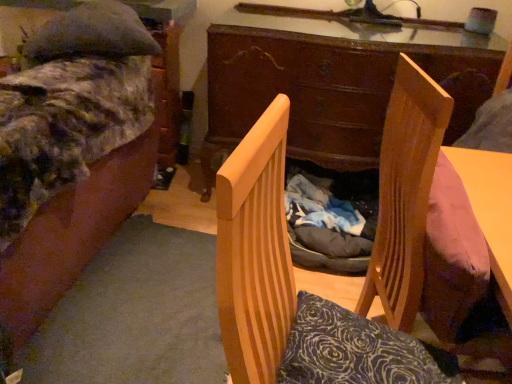
Question: From the image's perspective, is velvet-like fabric bed at left above wooden desk at center?

Choices:
 (A) no
 (B) yes

Answer: (A)

Question: Does velvet-like fabric bed at left have a smaller size compared to wooden desk at center?

Choices:
 (A) yes
 (B) no

Answer: (B)

Question: Considering the relative sizes of velvet-like fabric bed at left and wooden desk at center in the image provided, is velvet-like fabric bed at left shorter than wooden desk at center?

Choices:
 (A) yes
 (B) no

Answer: (B)

Question: Is velvet-like fabric bed at left wider than wooden desk at center?

Choices:
 (A) no
 (B) yes

Answer: (B)

Question: Is velvet-like fabric bed at left taller than wooden desk at center?

Choices:
 (A) no
 (B) yes

Answer: (B)

Question: Is velvet-like fabric bed at left thinner than wooden desk at center?

Choices:
 (A) no
 (B) yes

Answer: (A)

Question: Is the depth of wooden desk at center greater than that of velvet-like fabric bed at left?

Choices:
 (A) no
 (B) yes

Answer: (B)

Question: Can you confirm if wooden desk at center is smaller than velvet-like fabric bed at left?

Choices:
 (A) yes
 (B) no

Answer: (A)

Question: Is wooden desk at center at the left side of velvet-like fabric bed at left?

Choices:
 (A) no
 (B) yes

Answer: (A)

Question: From a real-world perspective, does wooden desk at center sit lower than velvet-like fabric bed at left?

Choices:
 (A) no
 (B) yes

Answer: (A)

Question: Does wooden desk at center have a lesser height compared to velvet-like fabric bed at left?

Choices:
 (A) yes
 (B) no

Answer: (A)

Question: Does wooden desk at center have a larger size compared to velvet-like fabric bed at left?

Choices:
 (A) no
 (B) yes

Answer: (A)

Question: Can you confirm if velvet-like fabric bed at left is shorter than wooden chair at center?

Choices:
 (A) yes
 (B) no

Answer: (B)